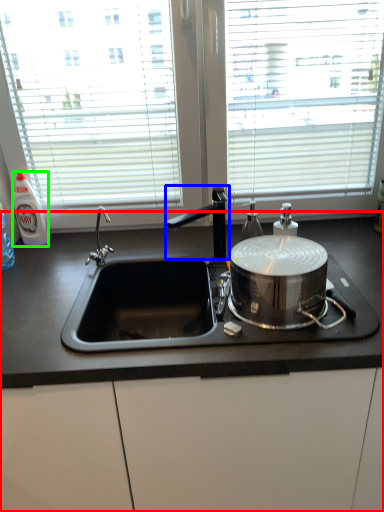
Question: Based on their relative distances, which object is farther from countertop (highlighted by a red box)? Choose from tap (highlighted by a blue box) and bottle (highlighted by a green box).

Choices:
 (A) tap
 (B) bottle

Answer: (B)